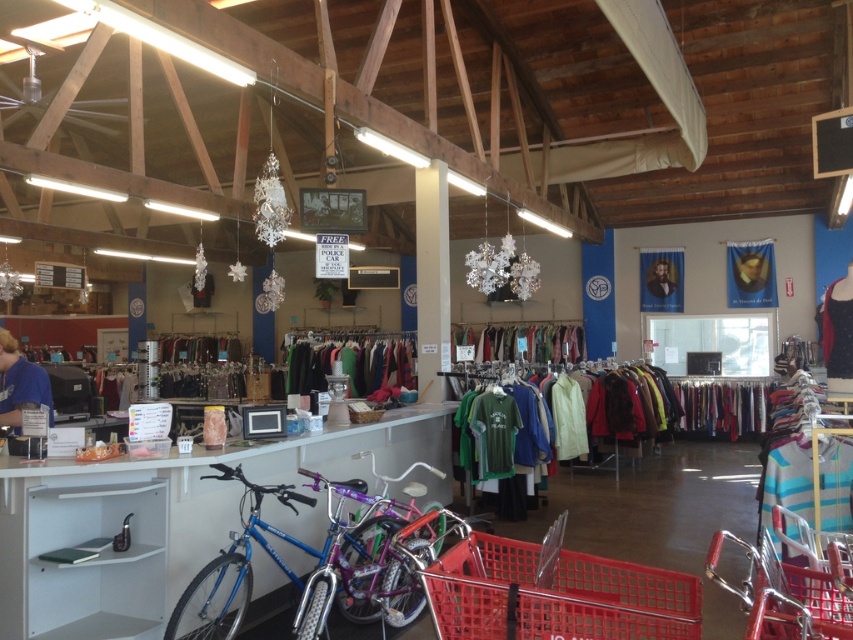
You are standing at the entrance of the thrift store and see the green fabric dress at center displayed in the middle of the room. If you want to reach the dress quickly, would you need to walk through the counter area on the left?

The green fabric dress at center is 10.52 meters away from the viewer. Since the counter area is on the left side of the image, you would need to walk past it to reach the dress, but the exact path isn